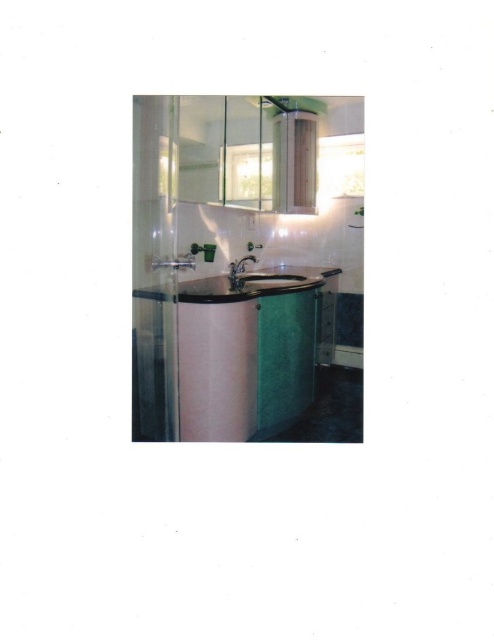
Question: Can you confirm if green marble counter top at center is positioned to the left of black glossy sink at center?

Choices:
 (A) yes
 (B) no

Answer: (A)

Question: Can you confirm if green marble counter top at center is positioned to the right of matte white sink at center?

Choices:
 (A) yes
 (B) no

Answer: (B)

Question: Which object is farther from the camera taking this photo?

Choices:
 (A) black glossy sink at center
 (B) matte white sink at center
 (C) green marble counter top at center

Answer: (B)

Question: Based on their relative distances, which object is nearer to the green marble counter top at center?

Choices:
 (A) matte white sink at center
 (B) black glossy sink at center

Answer: (B)

Question: Can you confirm if green marble counter top at center is positioned below matte white sink at center?

Choices:
 (A) no
 (B) yes

Answer: (B)

Question: Which point appears closest to the camera in this image?

Choices:
 (A) (240, 417)
 (B) (244, 284)
 (C) (262, 273)

Answer: (A)